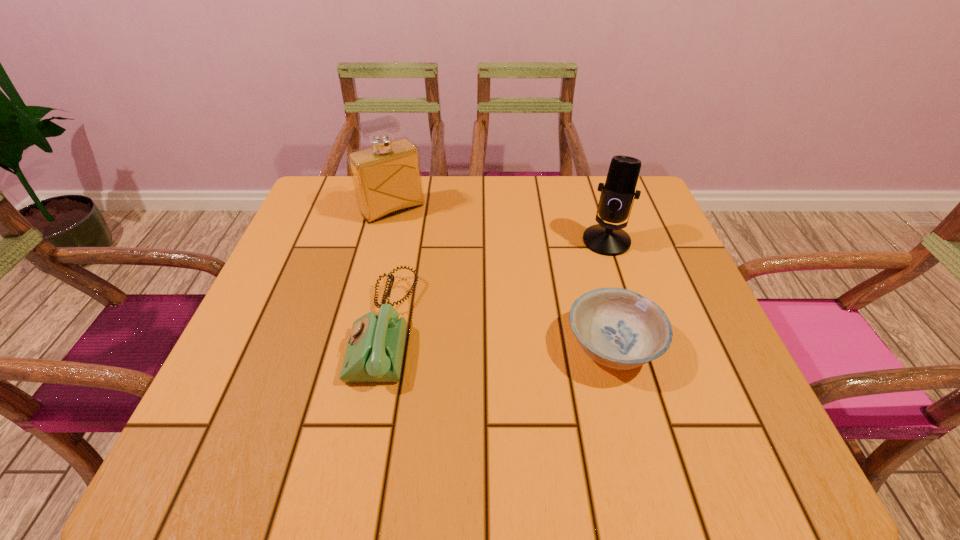
Where is `free space between the telephone and the bowl`? free space between the telephone and the bowl is located at coordinates (499, 337).

Identify the location of blank region between the farthest object and the second farthest object. The height and width of the screenshot is (540, 960). (499, 225).

At what (x,y) coordinates should I click in order to perform the action: click on vacant area between the bowl and the farthest object. Please return your answer as a coordinate pair (x, y). This screenshot has height=540, width=960. Looking at the image, I should click on (502, 278).

Point out which object is positioned as the nearest to the farthest object. Please provide its 2D coordinates. Your answer should be formatted as a tuple, i.e. [(x, y)], where the tuple contains the x and y coordinates of a point satisfying the conditions above.

[(374, 353)]

Identify which object is located as the nearest to the perfume. Please provide its 2D coordinates. Your answer should be formatted as a tuple, i.e. [(x, y)], where the tuple contains the x and y coordinates of a point satisfying the conditions above.

[(374, 353)]

Find the location of a particular element. free space that satisfies the following two spatial constraints: 1. on the front side of the telephone; 2. on the dial of the perfume is located at coordinates (364, 327).

Image resolution: width=960 pixels, height=540 pixels. What are the coordinates of `blank area in the image that satisfies the following two spatial constraints: 1. on the front side of the perfume; 2. on the left side of the bowl` in the screenshot? It's located at (359, 346).